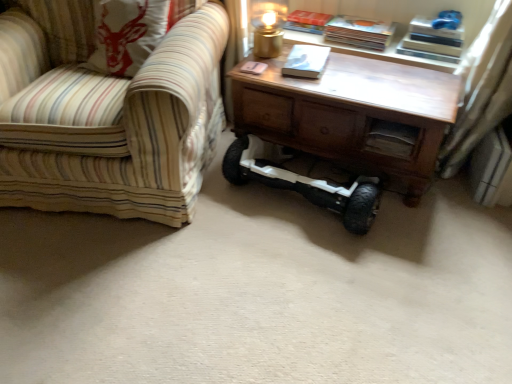
Question: Considering their positions, is hardcover book at upper center, the third book viewed from the front, located in front of or behind gold metallic table lamp at upper center?

Choices:
 (A) front
 (B) behind

Answer: (B)

Question: In terms of height, does hardcover book at upper center, which appears as the 1th book when viewed from the back, look taller or shorter compared to gold metallic table lamp at upper center?

Choices:
 (A) tall
 (B) short

Answer: (B)

Question: Estimate the real-world distances between objects in this image. Which object is closer to the wooden drawer at center?

Choices:
 (A) hardcover book at upper right, positioned as the second book in front-to-back order
 (B) gold metallic table lamp at upper center
 (C) hardcover book at upper center, the third book viewed from the front
 (D) striped fabric chair at left
 (E) white matte book at center, positioned as the 3th book in back-to-front order

Answer: (E)

Question: Based on their relative distances, which object is farther from the white matte book at center, positioned as the 3th book in back-to-front order?

Choices:
 (A) wooden table at center
 (B) white matte hoverboard at center
 (C) hardcover book at upper right, positioned as the second book in front-to-back order
 (D) striped fabric chair at left
 (E) gold metallic table lamp at upper center

Answer: (D)